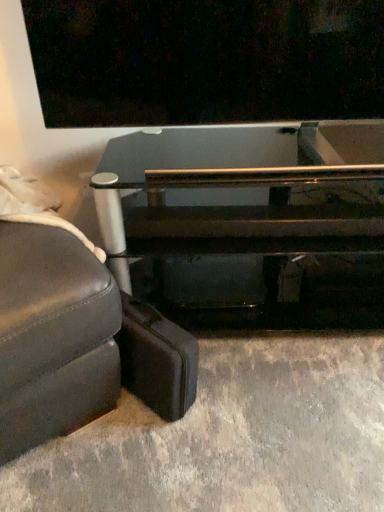
Locate an element on the screen. free spot above leather suitcase at lower left (from a real-world perspective) is located at coordinates (148, 326).